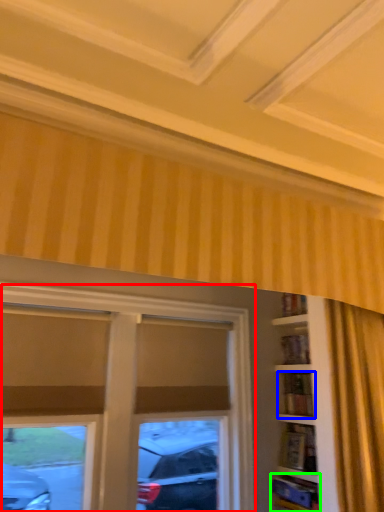
Question: Considering the real-world distances, which object is closest to window (highlighted by a red box)? shelf (highlighted by a blue box) or shelf (highlighted by a green box).

Choices:
 (A) shelf
 (B) shelf

Answer: (A)